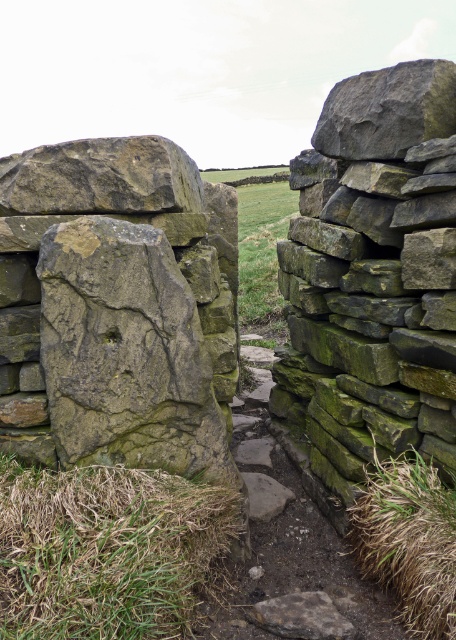
Which is below, green mossy stone at center or rough textured stone at upper left?

green mossy stone at center is lower down.

Describe the element at coordinates (119, 301) in the screenshot. This screenshot has width=456, height=640. I see `green mossy stone at center` at that location.

Does point (156, 275) come in front of point (67, 173)?

Yes, point (156, 275) is in front of point (67, 173).

Identify the location of green mossy stone at center. (119, 301).

Which is above, green mossy stone wall at right or rough textured rock at upper right?

rough textured rock at upper right is higher up.

What do you see at coordinates (373, 275) in the screenshot?
I see `green mossy stone wall at right` at bounding box center [373, 275].

Is point (390, 236) farther from camera compared to point (384, 116)?

Yes, point (390, 236) is behind point (384, 116).

The height and width of the screenshot is (640, 456). In order to click on green mossy stone wall at right in this screenshot , I will do `click(373, 275)`.

Does green grassy hay at lower left have a lesser height compared to green mossy stone path at center?

No.

Is green grassy hay at lower left to the right of green mossy stone path at center from the viewer's perspective?

No, green grassy hay at lower left is not to the right of green mossy stone path at center.

Does point (14, 563) come in front of point (388, 628)?

Yes, point (14, 563) is closer to viewer.

The image size is (456, 640). Find the location of `green grassy hay at lower left`. green grassy hay at lower left is located at coordinates (107, 550).